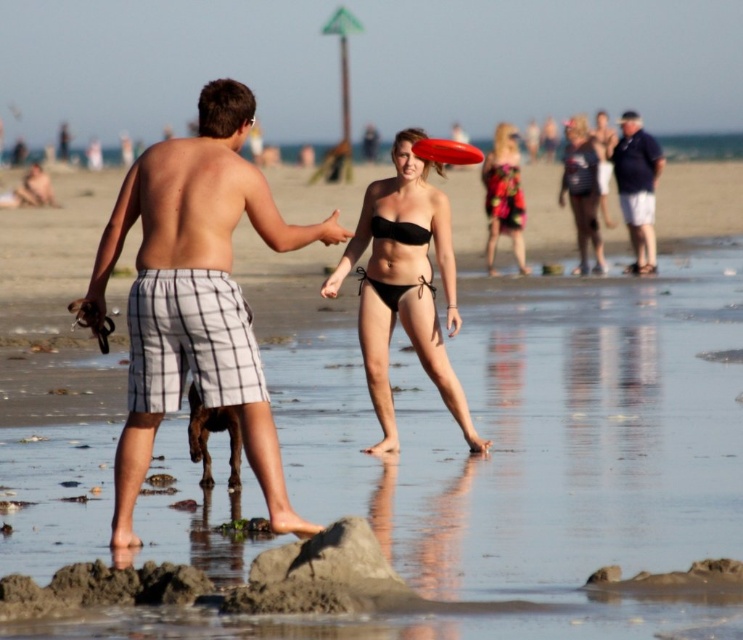
You are a photographer trying to capture a candid shot of the woman in the black bikini. You see the floral dress at center and the red plastic frisbee at center in your viewfinder. Which object should you move your camera to avoid blocking your subject?

The red plastic frisbee at center is behind the floral dress at center, so moving the camera to avoid the floral dress at center will ensure the frisbee does not block the woman in the black bikini.

You are a photographer trying to capture a candid shot of the two people in the scene. You notice the black bikini at upper center and the matte black bikini at center. Which of the two bikinis is positioned lower in the image?

The matte black bikini at center is positioned lower in the image since the black bikini at upper center has a lesser height compared to it.